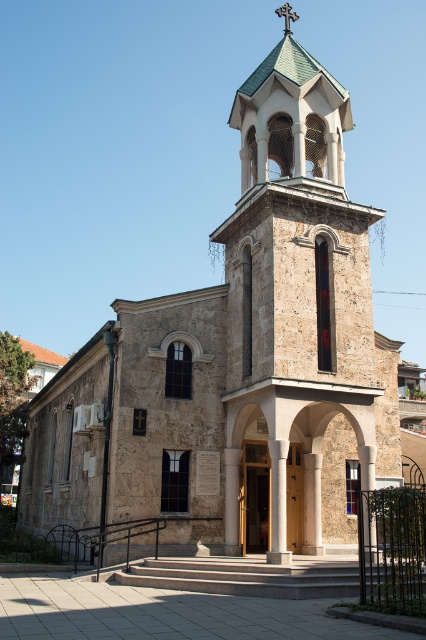
You are standing in front of the church and want to take a photo of the stone steeple at center and the green tile spire at upper center. Which one will appear closer to you in the photo?

The stone steeple at center will appear closer to you in the photo because it is in front of the green tile spire at upper center.

You are standing in front of the church and want to take a photo that includes both the stone steeple at center and the green tile spire at upper center. Which object should be placed to the right side in your photo?

The stone steeple at center should be placed to the right side in your photo because it is positioned on the right side of the green tile spire at upper center.

You are standing in front of the church and notice two points marked on the bell tower. The first point is at coordinate point[316,438] and the second is at point[339,173]. Which point is closer to you?

Point[316,438] is closer to the camera than point[339,173], so the first point is closer to you.